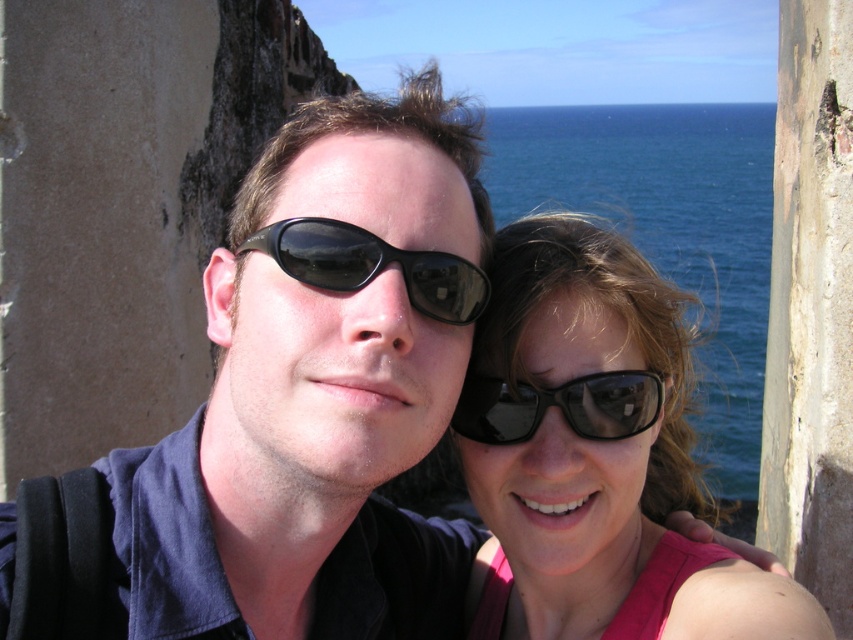
Question: Is pink matte sunglasses at center closer to the viewer compared to black reflective sunglasses at center?

Choices:
 (A) yes
 (B) no

Answer: (A)

Question: Does pink matte sunglasses at center have a greater width compared to black plastic sunglasses at center?

Choices:
 (A) no
 (B) yes

Answer: (B)

Question: Which is nearer to the black reflective sunglasses at center?

Choices:
 (A) pink matte sunglasses at center
 (B) black plastic sunglasses at center

Answer: (B)

Question: Which of the following is the farthest from the observer?

Choices:
 (A) black plastic sunglasses at center
 (B) pink matte sunglasses at center

Answer: (A)

Question: Can you confirm if pink matte sunglasses at center is positioned to the right of black plastic sunglasses at center?

Choices:
 (A) yes
 (B) no

Answer: (A)

Question: Which point is closer to the camera taking this photo?

Choices:
 (A) (334, 248)
 (B) (619, 432)

Answer: (A)